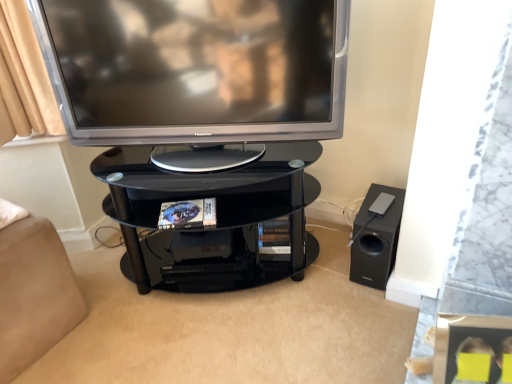
Question: From a real-world perspective, is black glass shelf at center on top of satin silver television at upper center?

Choices:
 (A) yes
 (B) no

Answer: (B)

Question: Is black glass shelf at center facing away from satin silver television at upper center?

Choices:
 (A) no
 (B) yes

Answer: (A)

Question: From the image's perspective, would you say black glass shelf at center is positioned over satin silver television at upper center?

Choices:
 (A) no
 (B) yes

Answer: (A)

Question: Can you confirm if black glass shelf at center is shorter than satin silver television at upper center?

Choices:
 (A) no
 (B) yes

Answer: (B)

Question: Can you confirm if black glass shelf at center is thinner than satin silver television at upper center?

Choices:
 (A) no
 (B) yes

Answer: (A)

Question: In terms of height, does beige fabric bed at lower left look taller or shorter compared to black matte speaker at lower right?

Choices:
 (A) short
 (B) tall

Answer: (B)

Question: Looking at the image, does beige fabric bed at lower left seem bigger or smaller compared to black matte speaker at lower right?

Choices:
 (A) big
 (B) small

Answer: (A)

Question: From a real-world perspective, is beige fabric bed at lower left above or below black matte speaker at lower right?

Choices:
 (A) above
 (B) below

Answer: (A)

Question: Considering the positions of beige fabric bed at lower left and black matte speaker at lower right in the image, is beige fabric bed at lower left wider or thinner than black matte speaker at lower right?

Choices:
 (A) thin
 (B) wide

Answer: (B)

Question: Is point (294, 264) closer or farther from the camera than point (391, 256)?

Choices:
 (A) farther
 (B) closer

Answer: (A)

Question: Considering their positions, is black glass shelf at center located in front of or behind black matte speaker at lower right?

Choices:
 (A) behind
 (B) front

Answer: (B)

Question: Considering the positions of black glass shelf at center and black matte speaker at lower right in the image, is black glass shelf at center bigger or smaller than black matte speaker at lower right?

Choices:
 (A) small
 (B) big

Answer: (B)

Question: From a real-world perspective, is black glass shelf at center above or below black matte speaker at lower right?

Choices:
 (A) below
 (B) above

Answer: (B)

Question: Would you say black glass shelf at center is inside or outside beige fabric bed at lower left?

Choices:
 (A) inside
 (B) outside

Answer: (B)

Question: Is black glass shelf at center to the left or to the right of beige fabric bed at lower left in the image?

Choices:
 (A) left
 (B) right

Answer: (B)